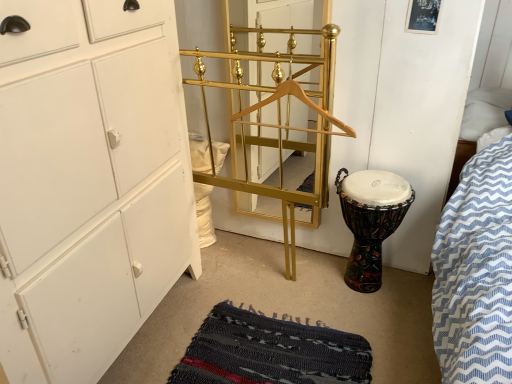
Question: From the image's perspective, is multicolored painted drum at lower right below gold/metallic coat rack at center?

Choices:
 (A) no
 (B) yes

Answer: (B)

Question: Does multicolored painted drum at lower right lie in front of gold/metallic coat rack at center?

Choices:
 (A) no
 (B) yes

Answer: (B)

Question: Is multicolored painted drum at lower right aimed at gold/metallic coat rack at center?

Choices:
 (A) yes
 (B) no

Answer: (B)

Question: From a real-world perspective, is multicolored painted drum at lower right physically below gold/metallic coat rack at center?

Choices:
 (A) yes
 (B) no

Answer: (A)

Question: Considering the relative sizes of multicolored painted drum at lower right and gold/metallic coat rack at center in the image provided, is multicolored painted drum at lower right smaller than gold/metallic coat rack at center?

Choices:
 (A) yes
 (B) no

Answer: (B)

Question: Choose the correct answer: Is multicolored painted drum at lower right inside wooden hanger at center or outside it?

Choices:
 (A) outside
 (B) inside

Answer: (A)

Question: Is multicolored painted drum at lower right in front of or behind wooden hanger at center in the image?

Choices:
 (A) behind
 (B) front

Answer: (A)

Question: In the image, is multicolored painted drum at lower right on the left side or the right side of wooden hanger at center?

Choices:
 (A) left
 (B) right

Answer: (B)

Question: Is multicolored painted drum at lower right bigger or smaller than wooden hanger at center?

Choices:
 (A) small
 (B) big

Answer: (B)

Question: From the image's perspective, relative to gold/metallic coat rack at center, is rag-textured mat at lower center above or below?

Choices:
 (A) above
 (B) below

Answer: (B)

Question: Considering the positions of rag-textured mat at lower center and gold/metallic coat rack at center in the image, is rag-textured mat at lower center taller or shorter than gold/metallic coat rack at center?

Choices:
 (A) short
 (B) tall

Answer: (A)

Question: Choose the correct answer: Is rag-textured mat at lower center inside gold/metallic coat rack at center or outside it?

Choices:
 (A) inside
 (B) outside

Answer: (B)

Question: Looking at the image, does rag-textured mat at lower center seem bigger or smaller compared to gold/metallic coat rack at center?

Choices:
 (A) small
 (B) big

Answer: (B)

Question: Is multicolored painted drum at lower right to the left or to the right of gold metallic coat rack at center in the image?

Choices:
 (A) left
 (B) right

Answer: (B)

Question: Is multicolored painted drum at lower right inside or outside of gold metallic coat rack at center?

Choices:
 (A) outside
 (B) inside

Answer: (A)